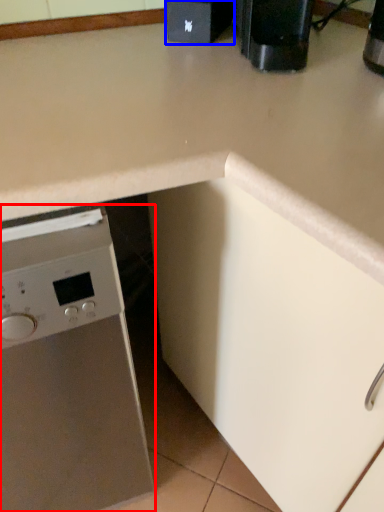
Question: Which of the following is the closest to the observer, home appliance (highlighted by a red box) or appliance (highlighted by a blue box)?

Choices:
 (A) home appliance
 (B) appliance

Answer: (A)